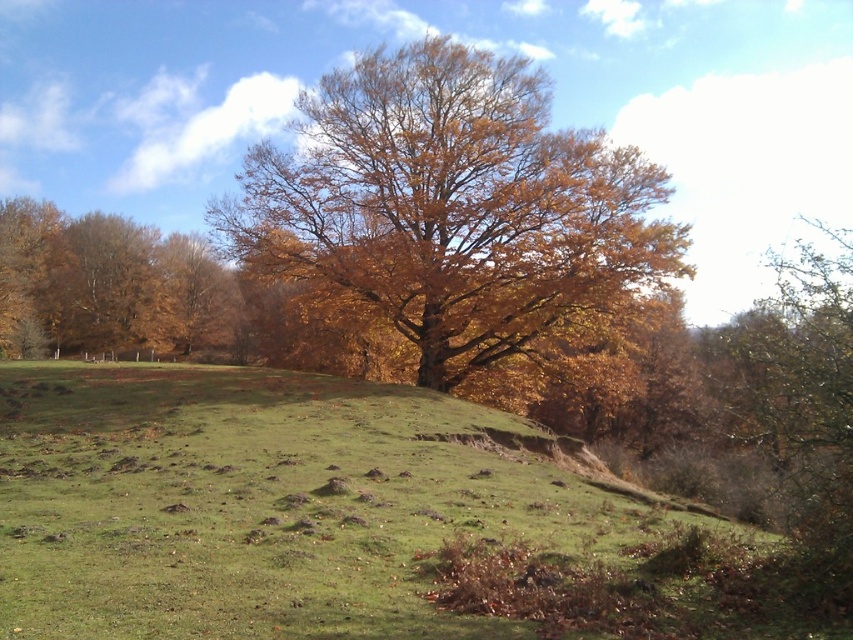
Consider the image. You are standing at the base of the large tree in the autumnal landscape and want to walk towards the green grass at center. Which direction should you head to reach it?

The green grass at center is located at point [265,506], so you should head towards the direction indicated by those coordinates to reach it.

You are a gardener planning to mow the green grass at center and trim the brown leafy tree at left. Based on their heights, which task would require a ladder?

The brown leafy tree at left is taller than the green grass at center, so trimming the brown leafy tree at left would require a ladder.